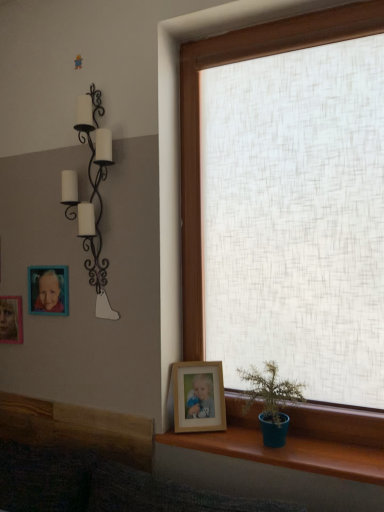
This screenshot has width=384, height=512. In order to click on vacant area that is situated to the right of teal ceramic pot at lower right in this screenshot , I will do coord(335,454).